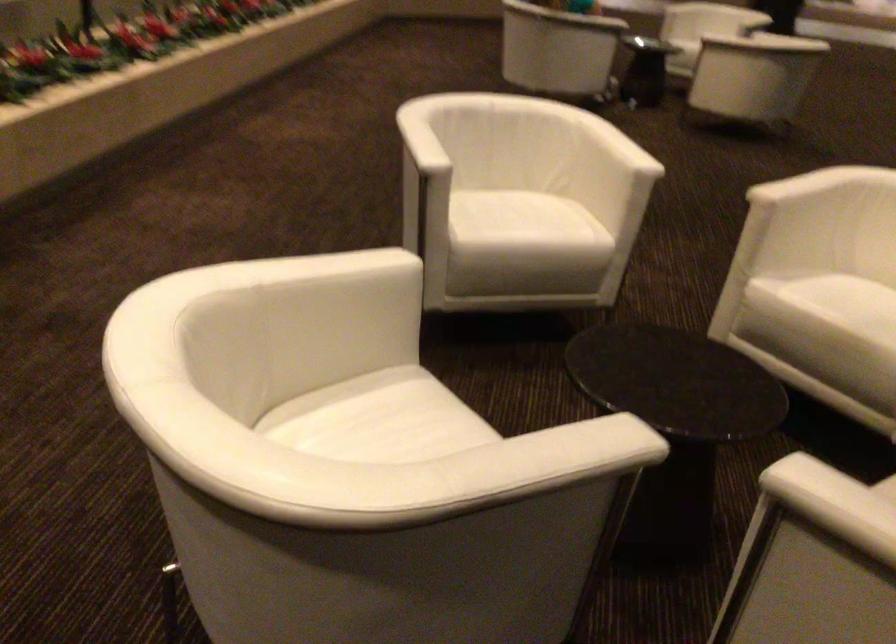
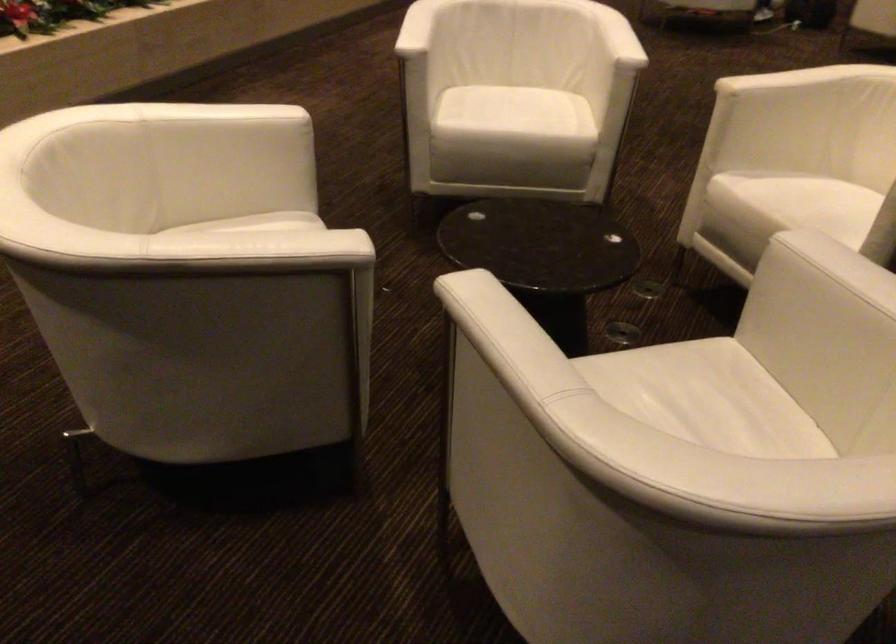
Locate, in the second image, the point that corresponds to the point at 540,228 in the first image.

(524, 117)